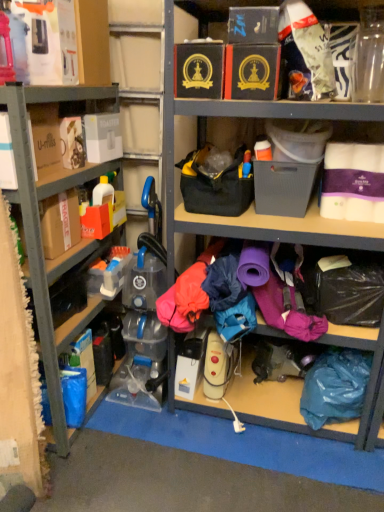
Question: Is teal fabric bag at lower right located outside matte black box at upper center, which appears as the 2th storage box when viewed from the right?

Choices:
 (A) yes
 (B) no

Answer: (A)

Question: Is teal fabric bag at lower right aimed at matte black box at upper center, which appears as the 2th storage box when viewed from the right?

Choices:
 (A) no
 (B) yes

Answer: (A)

Question: Is teal fabric bag at lower right to the left of matte black box at upper center, which appears as the 2th storage box when viewed from the right, from the viewer's perspective?

Choices:
 (A) yes
 (B) no

Answer: (B)

Question: Does teal fabric bag at lower right have a greater width compared to matte black box at upper center, marked as the 4th storage box in a left-to-right arrangement?

Choices:
 (A) yes
 (B) no

Answer: (B)

Question: Is the position of teal fabric bag at lower right more distant than that of matte black box at upper center, which appears as the 2th storage box when viewed from the right?

Choices:
 (A) no
 (B) yes

Answer: (B)

Question: From a real-world perspective, is matte black box at upper center, which appears as the 2th storage box when viewed from the right, physically located above or below gray plastic storage box at center, which is counted as the first storage box, starting from the right?

Choices:
 (A) below
 (B) above

Answer: (B)

Question: Considering the positions of matte black box at upper center, marked as the 4th storage box in a left-to-right arrangement, and gray plastic storage box at center, the 5th storage box when ordered from left to right, in the image, is matte black box at upper center, marked as the 4th storage box in a left-to-right arrangement, wider or thinner than gray plastic storage box at center, the 5th storage box when ordered from left to right,?

Choices:
 (A) wide
 (B) thin

Answer: (A)

Question: In terms of size, does matte black box at upper center, marked as the 4th storage box in a left-to-right arrangement, appear bigger or smaller than gray plastic storage box at center, the 5th storage box when ordered from left to right?

Choices:
 (A) small
 (B) big

Answer: (A)

Question: In the image, is matte black box at upper center, which appears as the 2th storage box when viewed from the right, positioned in front of or behind gray plastic storage box at center, the 5th storage box when ordered from left to right?

Choices:
 (A) behind
 (B) front

Answer: (B)

Question: Considering the positions of matte plastic container at left and gray plastic storage box at center, the 5th storage box when ordered from left to right, in the image, is matte plastic container at left wider or thinner than gray plastic storage box at center, the 5th storage box when ordered from left to right,?

Choices:
 (A) thin
 (B) wide

Answer: (B)

Question: From a real-world perspective, relative to gray plastic storage box at center, which is counted as the first storage box, starting from the right, is matte plastic container at left vertically above or below?

Choices:
 (A) above
 (B) below

Answer: (B)

Question: Is point (23, 202) positioned closer to the camera than point (266, 163)?

Choices:
 (A) farther
 (B) closer

Answer: (B)

Question: From their relative heights in the image, would you say matte plastic container at left is taller or shorter than gray plastic storage box at center, the 5th storage box when ordered from left to right?

Choices:
 (A) tall
 (B) short

Answer: (A)

Question: Is black cardboard box at upper center, placed as the 3th storage box when sorted from left to right, situated inside matte black box at upper center, marked as the 4th storage box in a left-to-right arrangement, or outside?

Choices:
 (A) inside
 (B) outside

Answer: (B)

Question: Is black cardboard box at upper center, arranged as the 3th storage box when viewed from the right, wider or thinner than matte black box at upper center, which appears as the 2th storage box when viewed from the right?

Choices:
 (A) wide
 (B) thin

Answer: (B)